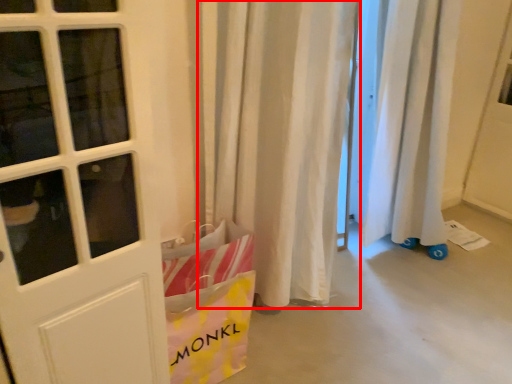
Question: From the image, what is the correct spatial relationship of curtain (annotated by the red box) in relation to grocery bag?

Choices:
 (A) left
 (B) right

Answer: (B)